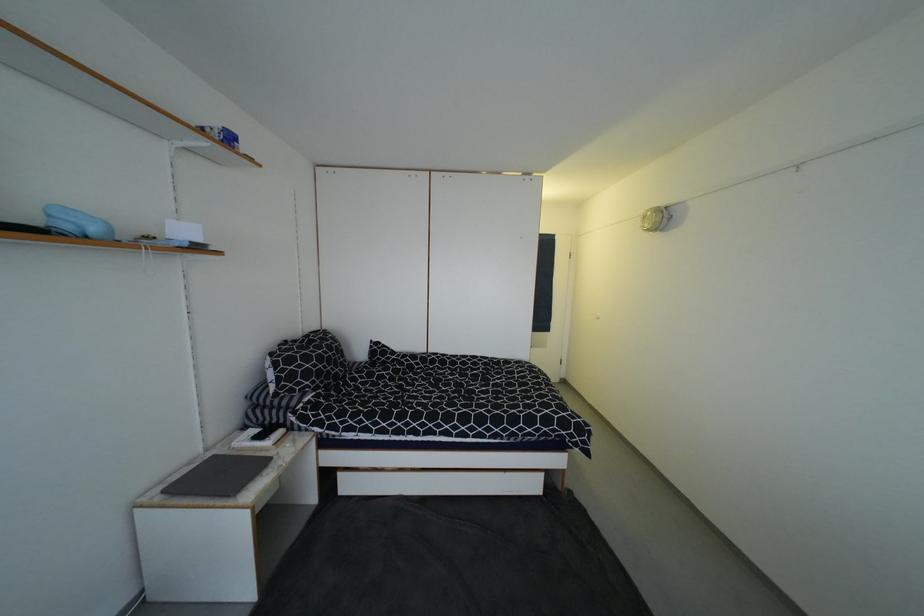
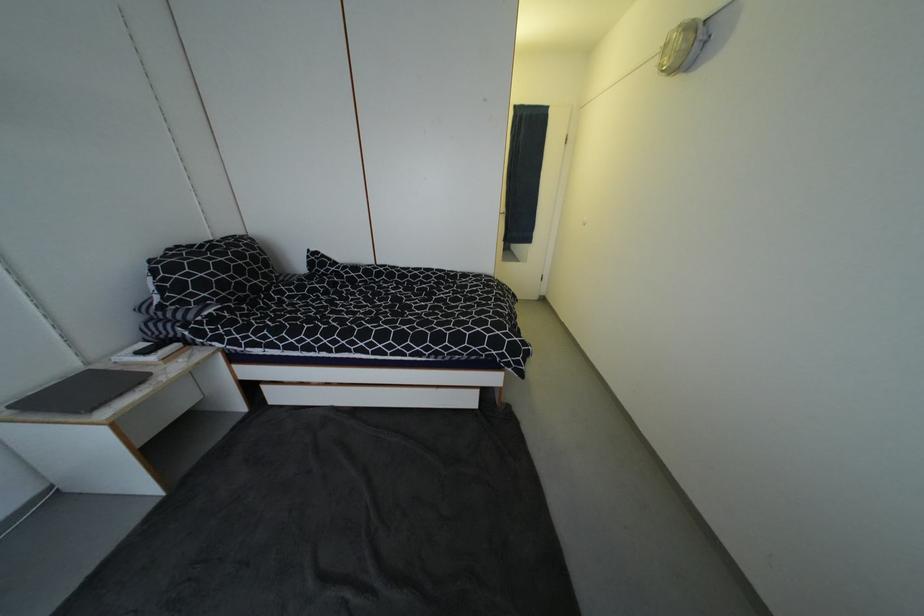
Question: Based on the continuous images, in which direction is the camera rotating? Reply with the corresponding letter.

Choices:
 (A) Left
 (B) Right
 (C) Up
 (D) Down

Answer: (D)